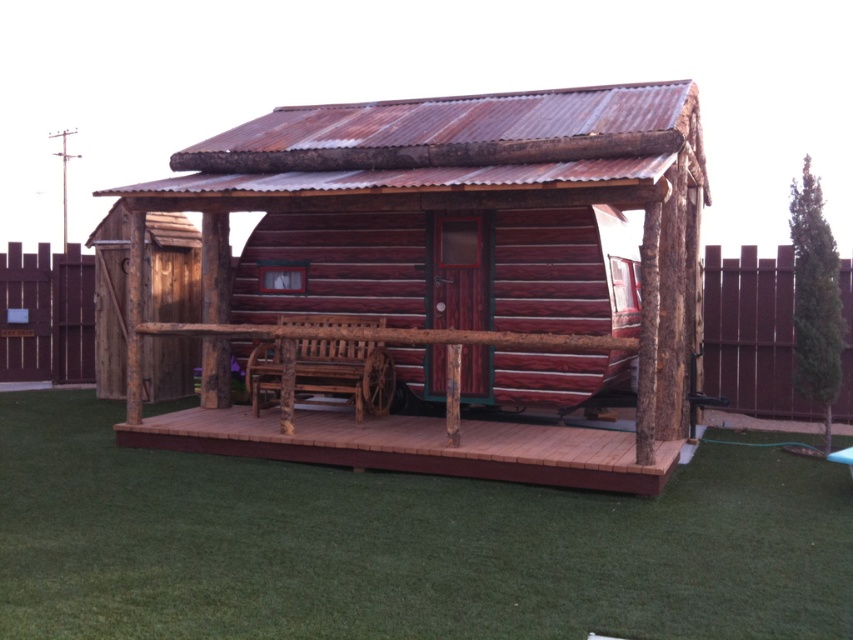
Question: Based on their relative distances, which object is farther from the brown wooden deck at center?

Choices:
 (A) brown wooden fence at right
 (B) green grass at lower center

Answer: (A)

Question: Which point is closer to the camera?

Choices:
 (A) (415, 538)
 (B) (546, 339)
 (C) (39, 320)
 (D) (318, 458)

Answer: (A)

Question: Can you confirm if brown wooden deck at center is positioned below brown wooden fence at right?

Choices:
 (A) yes
 (B) no

Answer: (A)

Question: Can you confirm if brown wooden deck at center is thinner than brown wooden fence at center?

Choices:
 (A) yes
 (B) no

Answer: (A)

Question: Which of the following is the closest to the observer?

Choices:
 (A) (706, 314)
 (B) (398, 429)

Answer: (B)

Question: Can you confirm if green grass at lower center is smaller than brown wooden deck at center?

Choices:
 (A) yes
 (B) no

Answer: (B)